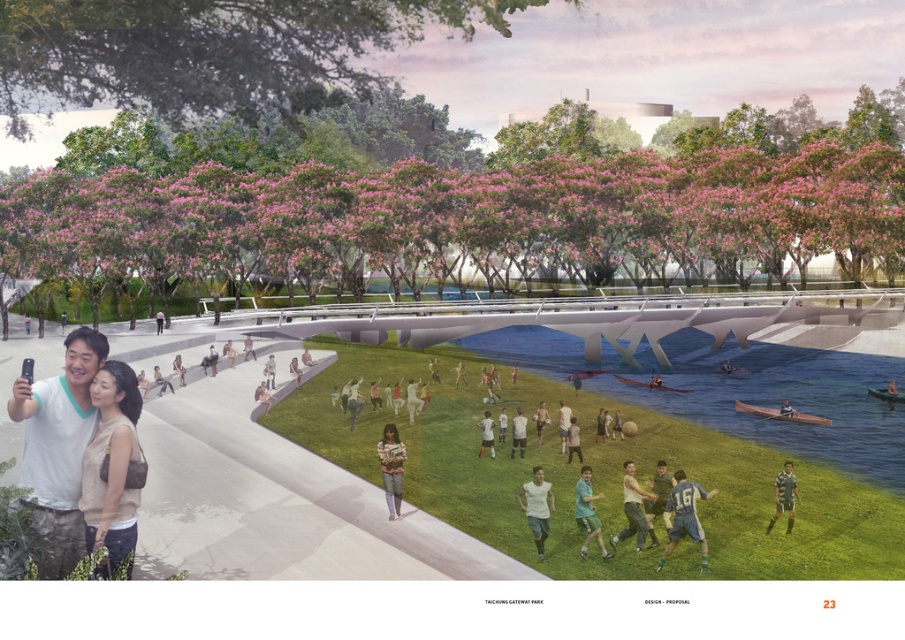
You are a landscape architect designing a new pathway in the park. You need to place a bench between the green leafy trees at center and the green leafy tree at upper center. What is the minimum distance the bench should be placed from each tree to ensure it is equidistant?

The bench should be placed exactly halfway between the green leafy trees at center and the green leafy tree at upper center. Since the distance between them is 51.29 meters, the minimum distance from each tree would be 51.29 divided by 2, which is 25.645 meters.

Based on the provided scene description, where is the green leafy tree at upper center located in terms of coordinates?

The green leafy tree at upper center is located at point coordinates of [206,49].